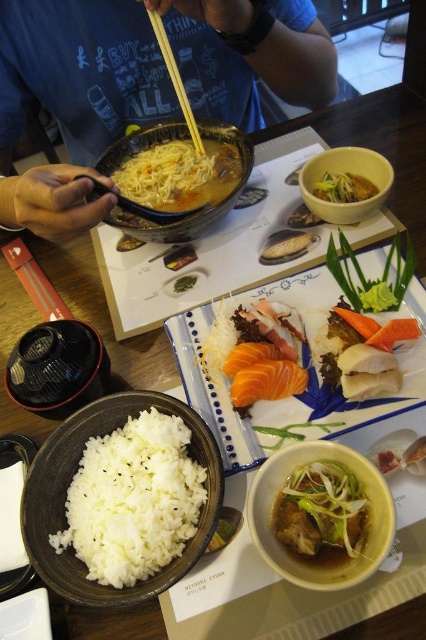
Between matte black bowl at upper center and matte ceramic bowl at center, which one has less height?

matte ceramic bowl at center is shorter.

Measure the distance between matte black bowl at upper center and camera.

A distance of 18.11 inches exists between matte black bowl at upper center and camera.

The height and width of the screenshot is (640, 426). Identify the location of matte black bowl at upper center. (140, 81).

Can you confirm if sashimi platter at center is shorter than white polished rice at center?

Incorrect, sashimi platter at center's height does not fall short of white polished rice at center's.

Which is more to the right, sashimi platter at center or white polished rice at center?

Positioned to the right is sashimi platter at center.

Locate an element on the screen. The height and width of the screenshot is (640, 426). sashimi platter at center is located at coordinates (304, 355).

Where is `sashimi platter at center`? sashimi platter at center is located at coordinates (304, 355).

Between shiny green leafy vegetables at center and smooth yellow rice at center, which one is positioned lower?

shiny green leafy vegetables at center is lower down.

Is point (325, 500) behind point (363, 195)?

No, (325, 500) is in front of (363, 195).

I want to click on shiny green leafy vegetables at center, so click(x=322, y=513).